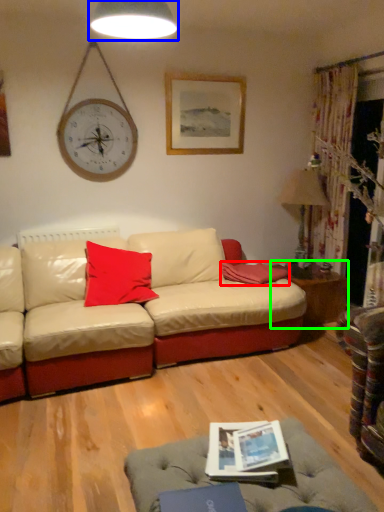
Question: Which object is positioned closest to pillow (highlighted by a red box)? Select from lamp (highlighted by a blue box) and table (highlighted by a green box).

Choices:
 (A) lamp
 (B) table

Answer: (B)